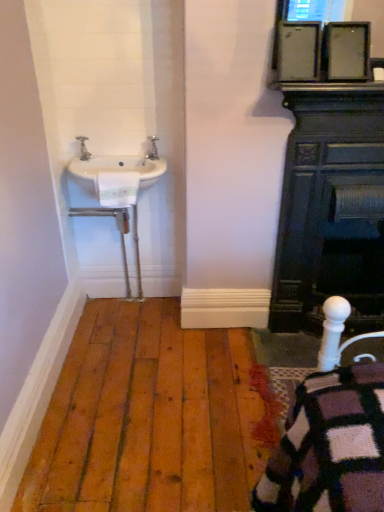
Question: Are black cast iron fireplace at right and polished brass faucet at upper left, the second tap when ordered from left to right, far apart?

Choices:
 (A) yes
 (B) no

Answer: (B)

Question: From the image's perspective, is black cast iron fireplace at right beneath polished brass faucet at upper left, the 1th tap in the right-to-left sequence?

Choices:
 (A) yes
 (B) no

Answer: (A)

Question: From the image's perspective, would you say black cast iron fireplace at right is positioned over polished brass faucet at upper left, the 1th tap in the right-to-left sequence?

Choices:
 (A) yes
 (B) no

Answer: (B)

Question: From a real-world perspective, is black cast iron fireplace at right physically below polished brass faucet at upper left, the 1th tap in the right-to-left sequence?

Choices:
 (A) no
 (B) yes

Answer: (B)

Question: Does black cast iron fireplace at right have a lesser height compared to polished brass faucet at upper left, the 1th tap in the right-to-left sequence?

Choices:
 (A) yes
 (B) no

Answer: (B)

Question: Is black cast iron fireplace at right positioned beyond the bounds of polished brass faucet at upper left, the 1th tap in the right-to-left sequence?

Choices:
 (A) yes
 (B) no

Answer: (A)

Question: Is white ceramic sink at left bigger than polished brass faucet at upper left, the 1th tap in the right-to-left sequence?

Choices:
 (A) no
 (B) yes

Answer: (B)

Question: Is white ceramic sink at left positioned far away from polished brass faucet at upper left, the 1th tap in the right-to-left sequence?

Choices:
 (A) no
 (B) yes

Answer: (A)

Question: Is white ceramic sink at left oriented towards polished brass faucet at upper left, the second tap when ordered from left to right?

Choices:
 (A) no
 (B) yes

Answer: (A)

Question: Is white ceramic sink at left taller than polished brass faucet at upper left, the second tap when ordered from left to right?

Choices:
 (A) no
 (B) yes

Answer: (B)

Question: Is white ceramic sink at left facing away from polished brass faucet at upper left, the 1th tap in the right-to-left sequence?

Choices:
 (A) yes
 (B) no

Answer: (B)

Question: Is white ceramic sink at left thinner than polished brass faucet at upper left, the second tap when ordered from left to right?

Choices:
 (A) no
 (B) yes

Answer: (A)

Question: Would you say silver metallic tap at upper left, which is the 2th tap from right to left, contains white ceramic sink at left?

Choices:
 (A) no
 (B) yes

Answer: (A)